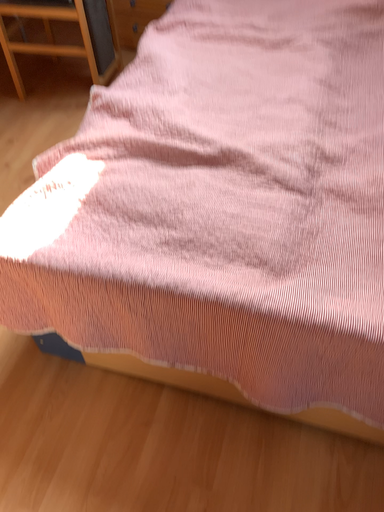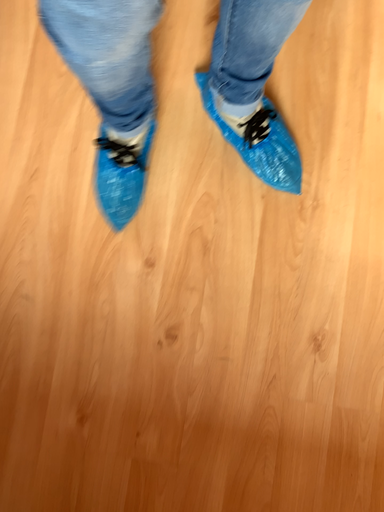
Question: Which way did the camera rotate in the video?

Choices:
 (A) rotated right
 (B) rotated left

Answer: (B)